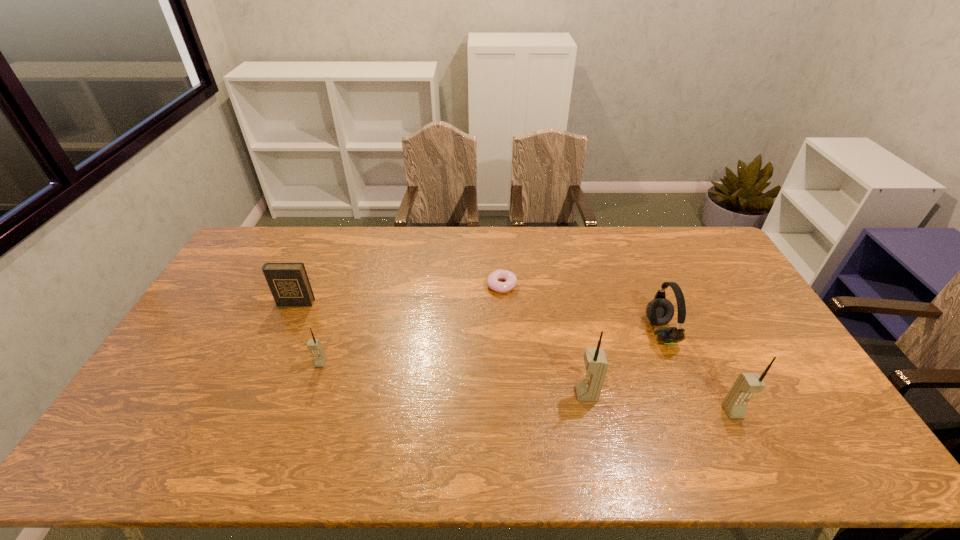
The width and height of the screenshot is (960, 540). Find the location of `the fifth object from right to left`. the fifth object from right to left is located at coordinates (314, 345).

Locate an element on the screen. the farthest cellular telephone is located at coordinates (314, 345).

The height and width of the screenshot is (540, 960). Identify the location of the second nearest object. (588, 389).

The height and width of the screenshot is (540, 960). In order to click on the second cellular telephone from right to left in this screenshot , I will do point(588,389).

At what (x,y) coordinates should I click in order to perform the action: click on the rightmost object. Please return your answer as a coordinate pair (x, y). This screenshot has width=960, height=540. Looking at the image, I should click on (735, 402).

This screenshot has width=960, height=540. I want to click on the second tallest cellular telephone, so click(x=735, y=402).

Find the location of a particular element. This screenshot has height=540, width=960. the leftmost object is located at coordinates (289, 284).

The width and height of the screenshot is (960, 540). What are the coordinates of `the fifth nearest object` in the screenshot? It's located at (289, 284).

The height and width of the screenshot is (540, 960). What are the coordinates of `the fifth object from left to right` in the screenshot? It's located at (660, 311).

The image size is (960, 540). Identify the location of the fourth nearest object. (660, 311).